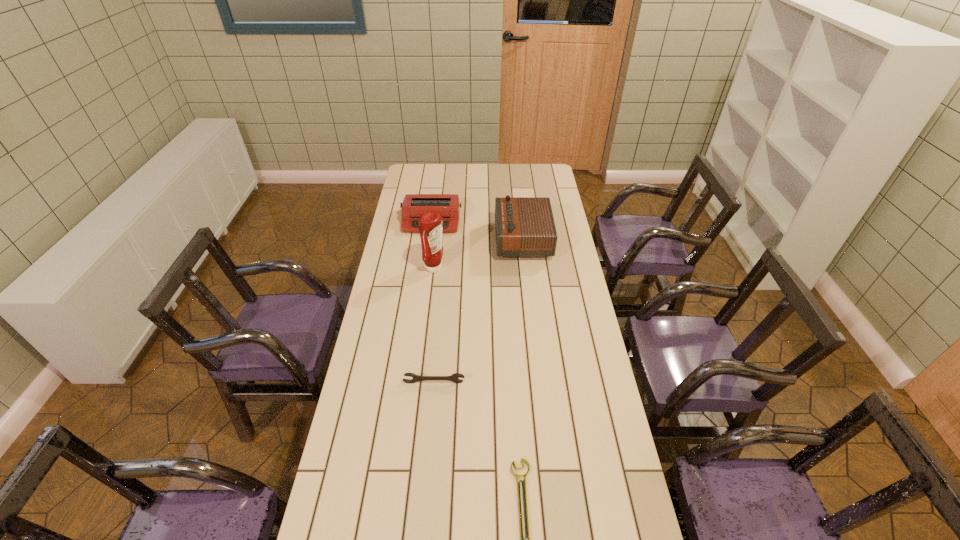
You are a GUI agent. You are given a task and a screenshot of the screen. Output one action in this format:
    pyautogui.click(x=<x>, y=<y>)
    Task: Click on the object that stands as the closest to the tallest object
    The height and width of the screenshot is (540, 960).
    Given the screenshot: What is the action you would take?
    pyautogui.click(x=414, y=206)

Identify which object is the nearest to the shorter wrench. Please provide its 2D coordinates. Your answer should be formatted as a tuple, i.e. [(x, y)], where the tuple contains the x and y coordinates of a point satisfying the conditions above.

[(453, 377)]

The image size is (960, 540). What are the coordinates of `blank area in the image that satisfies the following two spatial constraints: 1. on the front panel of the radio receiver; 2. on the open ends of the left wrench` in the screenshot? It's located at coord(539,382).

The width and height of the screenshot is (960, 540). What are the coordinates of `free space in the image that satisfies the following two spatial constraints: 1. on the typing side of the tallest object; 2. on the left side of the third tallest object` in the screenshot? It's located at (425, 268).

This screenshot has height=540, width=960. Find the location of `vacant space that satisfies the following two spatial constraints: 1. on the typing side of the condiment; 2. on the right side of the third tallest object`. vacant space that satisfies the following two spatial constraints: 1. on the typing side of the condiment; 2. on the right side of the third tallest object is located at coordinates (425, 268).